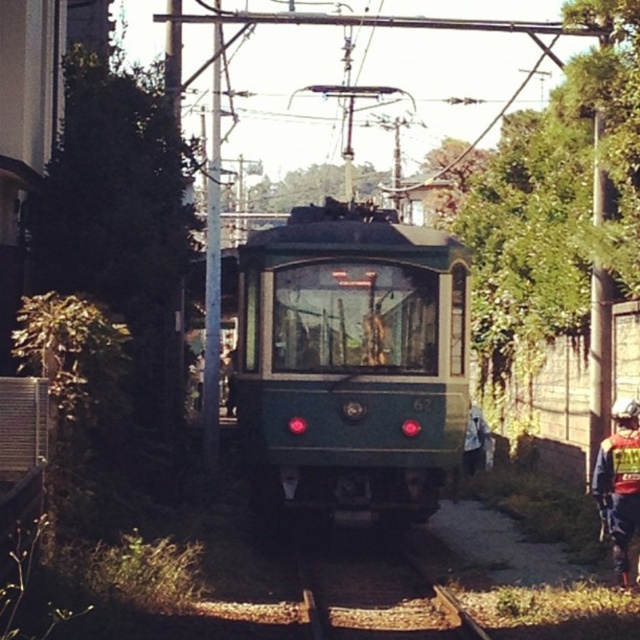
Question: Which point is farther to the camera?

Choices:
 (A) (609, 528)
 (B) (310, 292)

Answer: (B)

Question: Considering the relative positions of green polished wood train at center and reflective silver helmet at lower right in the image provided, where is green polished wood train at center located with respect to reflective silver helmet at lower right?

Choices:
 (A) right
 (B) left

Answer: (B)

Question: Does green polished wood train at center appear on the left side of reflective silver helmet at lower right?

Choices:
 (A) yes
 (B) no

Answer: (A)

Question: Among these points, which one is farthest from the camera?

Choices:
 (A) (x=605, y=445)
 (B) (x=404, y=314)

Answer: (B)

Question: Which object appears farthest from the camera in this image?

Choices:
 (A) green polished wood train at center
 (B) reflective silver helmet at lower right

Answer: (A)

Question: Is green polished wood train at center to the right of reflective silver helmet at lower right from the viewer's perspective?

Choices:
 (A) yes
 (B) no

Answer: (B)